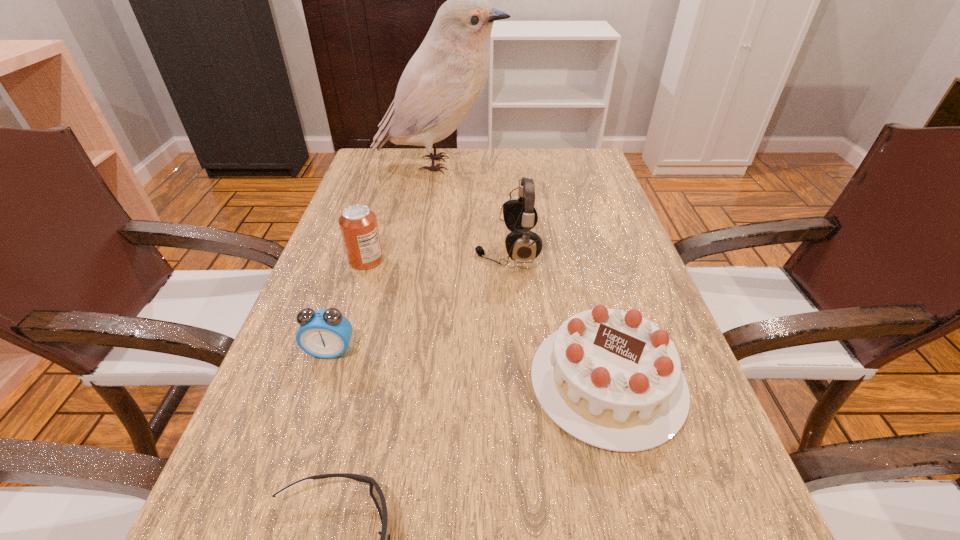
Where is `vacant region located on the back of the can`? The image size is (960, 540). vacant region located on the back of the can is located at coordinates (373, 235).

This screenshot has height=540, width=960. What are the coordinates of `vacant area situated 0.080m on the left of the birthday cake` in the screenshot? It's located at (485, 381).

You are a GUI agent. You are given a task and a screenshot of the screen. Output one action in this format:
    pyautogui.click(x=<x>, y=<y>)
    Task: Click on the free location located 0.270m on the face of the alarm clock
    This screenshot has width=960, height=540.
    Given the screenshot: What is the action you would take?
    pyautogui.click(x=276, y=521)

Image resolution: width=960 pixels, height=540 pixels. Find the location of `object that is at the far edge`. object that is at the far edge is located at coordinates (441, 83).

Find the location of a particular element. parakeet present at the left edge is located at coordinates (441, 83).

Where is `can present at the left edge`? The width and height of the screenshot is (960, 540). can present at the left edge is located at coordinates (358, 224).

Identify the location of alarm clock at the left edge. This screenshot has width=960, height=540. (324, 333).

Where is `object located at the right edge`? The image size is (960, 540). object located at the right edge is located at coordinates (612, 379).

Identify the location of object that is at the far left corner. (441, 83).

Where is `free location at the far edge`? free location at the far edge is located at coordinates [521, 157].